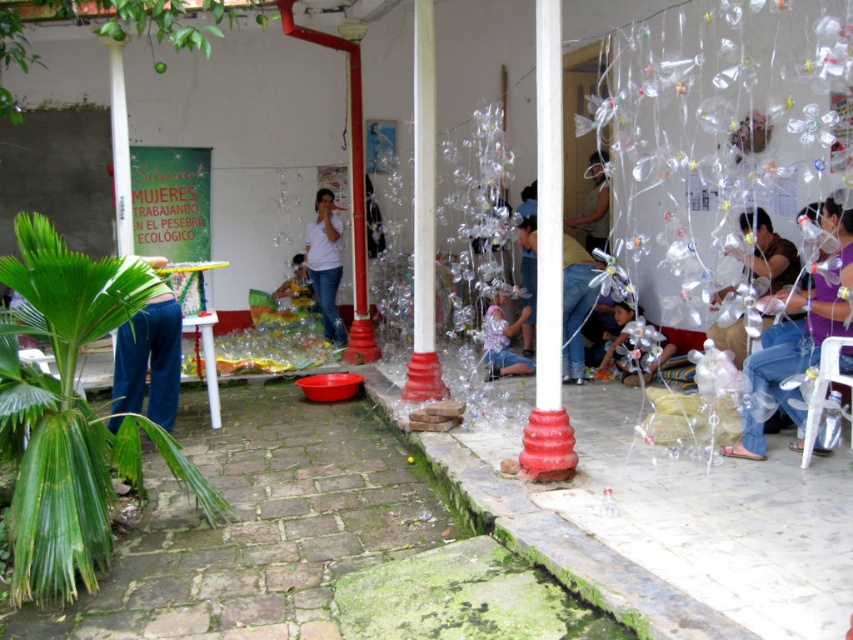
Please provide the 2D coordinates of the blue jeans at left in the image.

The blue jeans at left are located at coordinates point [149,358].

You are an artist setting up an exhibition in this space. You have two items to place on a central display table. The metallic silver pinwheel at center and the yellow fabric at center. According to the scene, which item should be placed to the left to maintain the original arrangement?

The yellow fabric at center should be placed to the left since the metallic silver pinwheel at center is originally positioned on the right side of the yellow fabric at center.